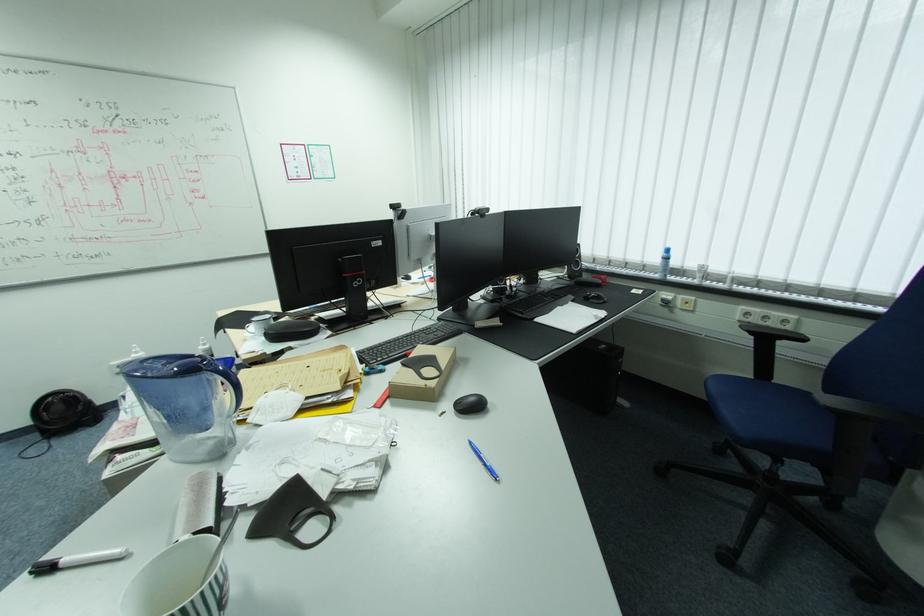
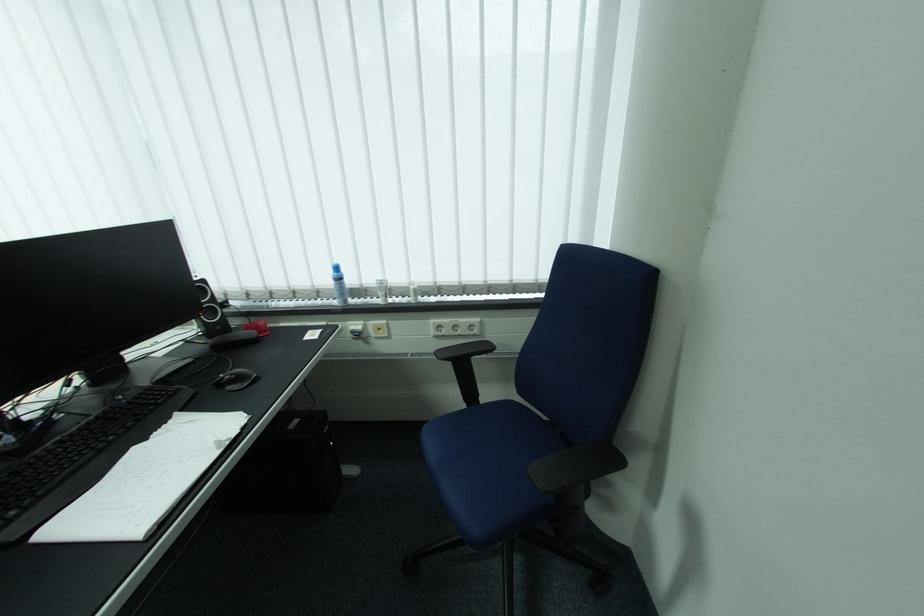
Find the pixel in the second image that matches (x=584, y=274) in the first image.

(225, 328)